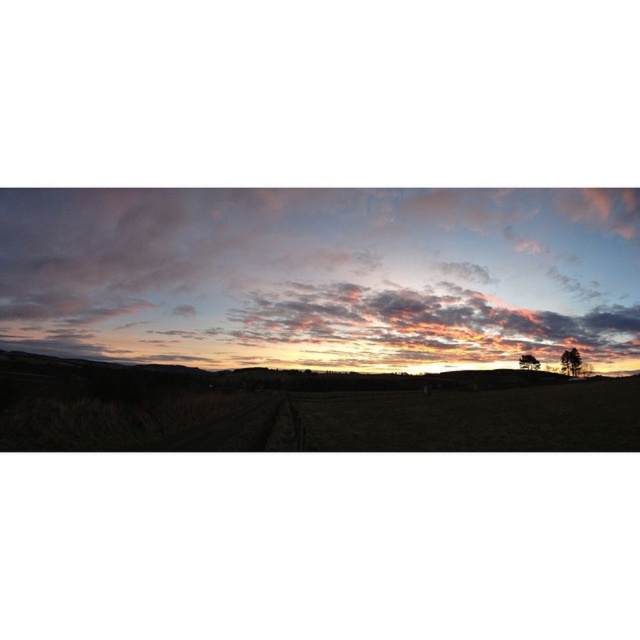
Question: Which object is farther from the camera taking this photo?

Choices:
 (A) green leafy tree at lower right
 (B) pastel cotton clouds at upper center
 (C) green matte tree at right

Answer: (C)

Question: Which is farther from the green leafy tree at lower right?

Choices:
 (A) pastel cotton clouds at upper center
 (B) green matte tree at right

Answer: (A)

Question: Is pastel cotton clouds at upper center positioned at the back of green leafy tree at lower right?

Choices:
 (A) yes
 (B) no

Answer: (B)

Question: Which object is positioned closest to the green leafy tree at lower right?

Choices:
 (A) green matte tree at right
 (B) pastel cotton clouds at upper center

Answer: (A)

Question: Considering the relative positions of pastel cotton clouds at upper center and green leafy tree at lower right in the image provided, where is pastel cotton clouds at upper center located with respect to green leafy tree at lower right?

Choices:
 (A) left
 (B) right

Answer: (A)

Question: Can you confirm if pastel cotton clouds at upper center is wider than green matte tree at right?

Choices:
 (A) no
 (B) yes

Answer: (B)